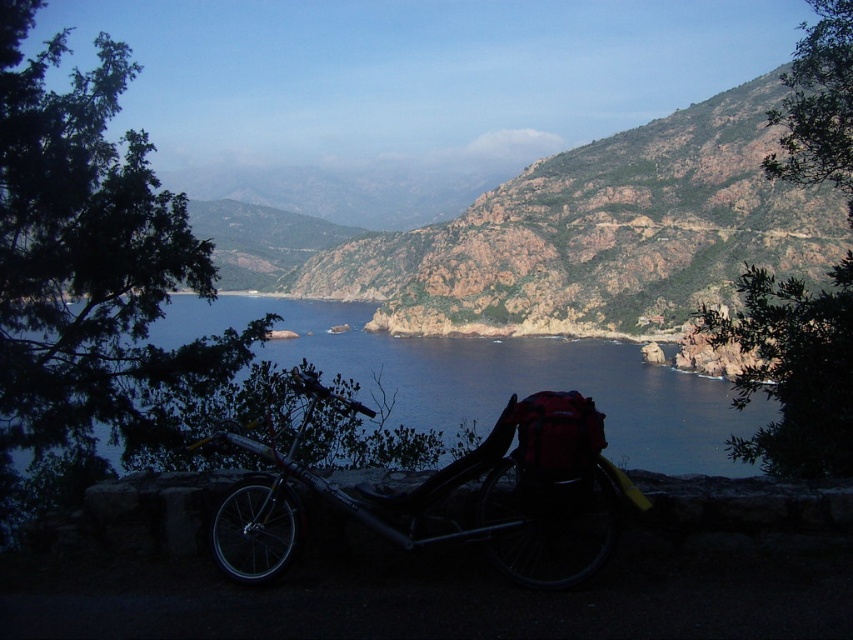
Question: Can you confirm if rustic rock cliff at center is bigger than blue water at center?

Choices:
 (A) yes
 (B) no

Answer: (A)

Question: Is rustic rock cliff at center closer to the viewer compared to silver metallic mountain bike at lower center?

Choices:
 (A) yes
 (B) no

Answer: (B)

Question: Which is nearer to the rustic rock cliff at center?

Choices:
 (A) blue water at center
 (B) silver metallic mountain bike at lower center

Answer: (A)

Question: Which object is the farthest from the silver metallic mountain bike at lower center?

Choices:
 (A) rustic rock cliff at center
 (B) blue water at center

Answer: (A)

Question: Which of these objects is positioned farthest from the silver metallic mountain bike at lower center?

Choices:
 (A) rustic rock cliff at center
 (B) blue water at center

Answer: (A)

Question: Does rustic rock cliff at center appear on the right side of silver metallic mountain bike at lower center?

Choices:
 (A) no
 (B) yes

Answer: (B)